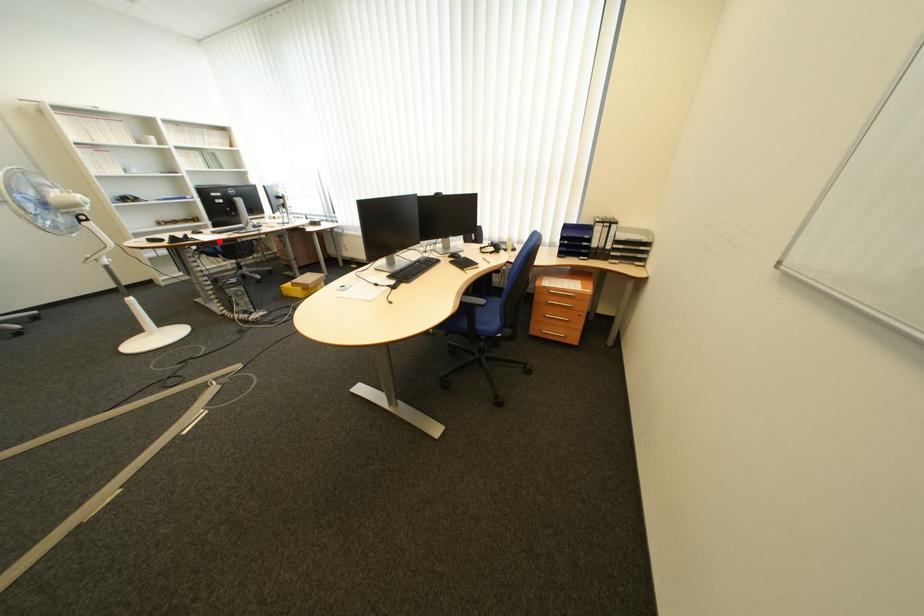
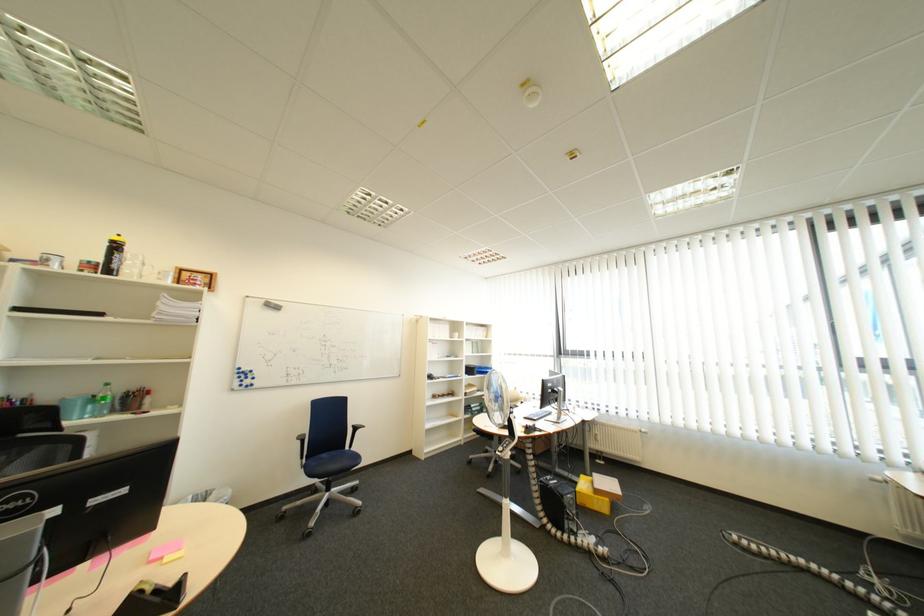
Where in the second image is the point corresponding to the highlighted location from the first image?

(565, 434)